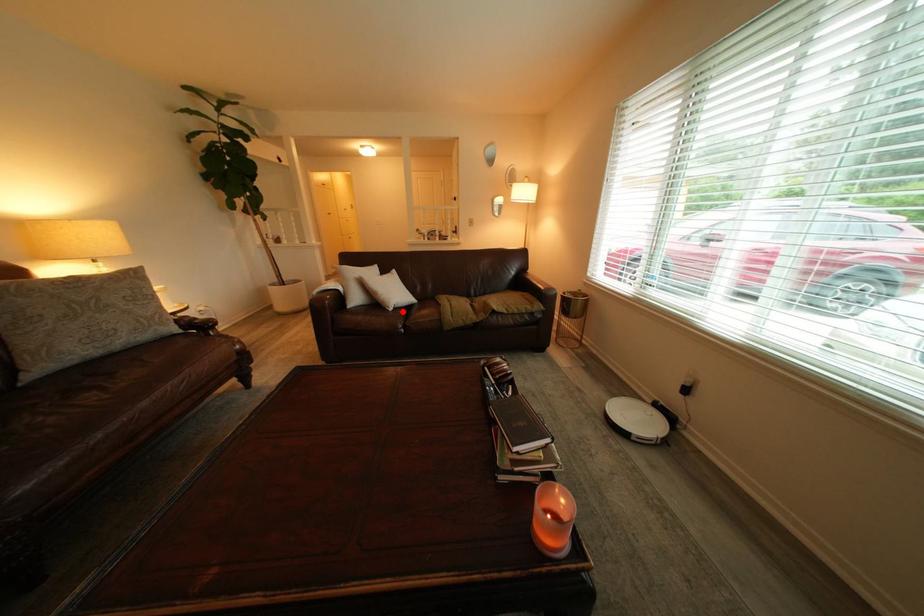
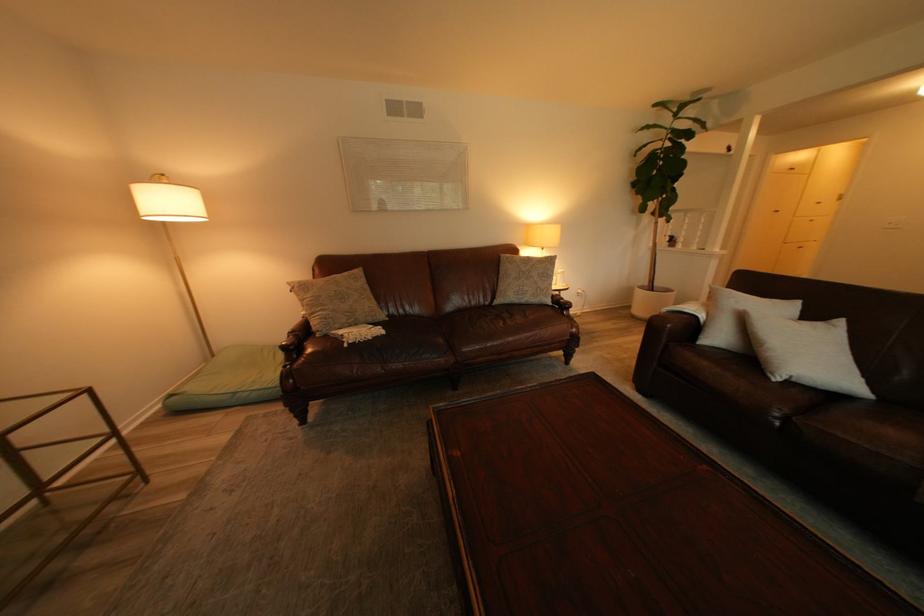
The point at the highlighted location is marked in the first image. Where is the corresponding point in the second image?

(784, 379)